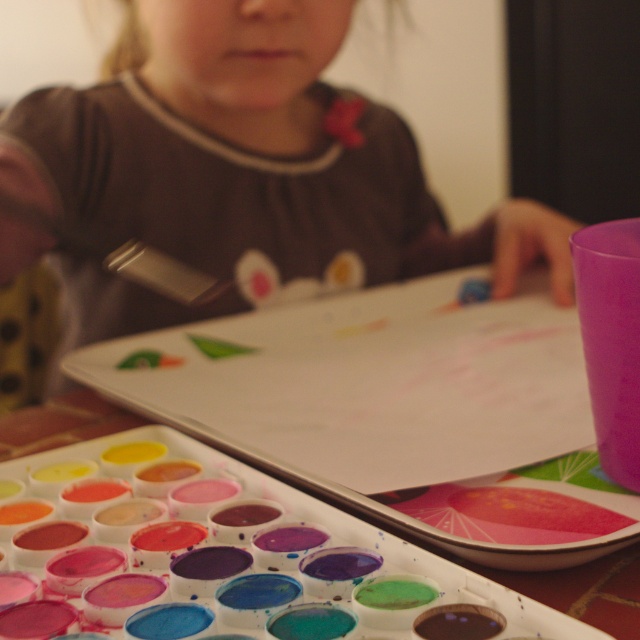
You are a photographer standing in front of the matte brown shirt at center. You want to take a clear photo of the shirt without any blur. What is the minimum distance you should maintain to ensure the photo is sharp?

The minimum distance you should maintain is 26.52 inches from the matte brown shirt at center to ensure the photo is sharp.

You are an art teacher observing a child at a table. You see the matte brown shirt at center and the metallic silver paint brush at upper center. Which object is closer to you from your viewpoint?

The matte brown shirt at center is closer to you because it is in front of the metallic silver paint brush at upper center.

The child is wearing a matte brown shirt at center. There is a point marked at coordinates (236, 170). Where is this point located in relation to the matte brown shirt at center?

The point at (236, 170) is located on the matte brown shirt at center.